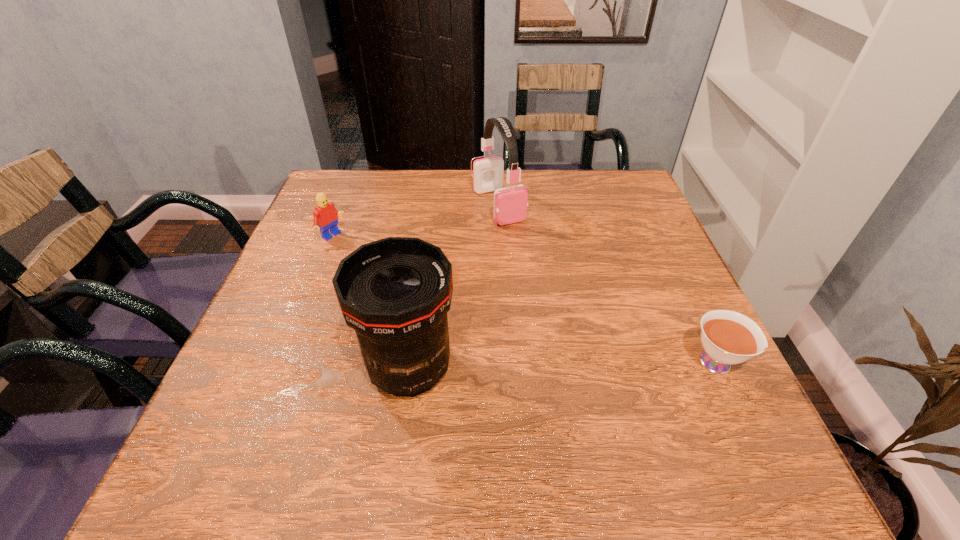
Identify the location of free spot between the rightmost object and the second object from left to right. This screenshot has height=540, width=960. (564, 366).

The width and height of the screenshot is (960, 540). Identify the location of free space that is in between the third tallest object and the farthest object. click(x=416, y=221).

You are a GUI agent. You are given a task and a screenshot of the screen. Output one action in this format:
    pyautogui.click(x=<x>, y=<y>)
    Task: Click on the free point between the earphone and the second farthest object
    
    Given the screenshot: What is the action you would take?
    pyautogui.click(x=416, y=221)

You are a GUI agent. You are given a task and a screenshot of the screen. Output one action in this format:
    pyautogui.click(x=<x>, y=<y>)
    Task: Click on the object that stands as the third closest to the second shortest object
    This screenshot has width=960, height=540.
    Given the screenshot: What is the action you would take?
    (x=728, y=337)

Locate which object ranks second in proximity to the shortest object. Please provide its 2D coordinates. Your answer should be formatted as a tuple, i.e. [(x, y)], where the tuple contains the x and y coordinates of a point satisfying the conditions above.

[(510, 203)]

What are the coordinates of `vacant region that satisfies the following two spatial constraints: 1. on the front side of the shortest object; 2. on the side of the Lego with the handle` in the screenshot? It's located at point(284,363).

Locate an element on the screen. free point that satisfies the following two spatial constraints: 1. on the front side of the Lego; 2. on the side of the shortest object with the handle is located at coordinates (284, 363).

At what (x,y) coordinates should I click in order to perform the action: click on free point that satisfies the following two spatial constraints: 1. on the front side of the second object from left to right; 2. on the right side of the Lego. Please return your answer as a coordinate pair (x, y). The width and height of the screenshot is (960, 540). Looking at the image, I should click on (282, 369).